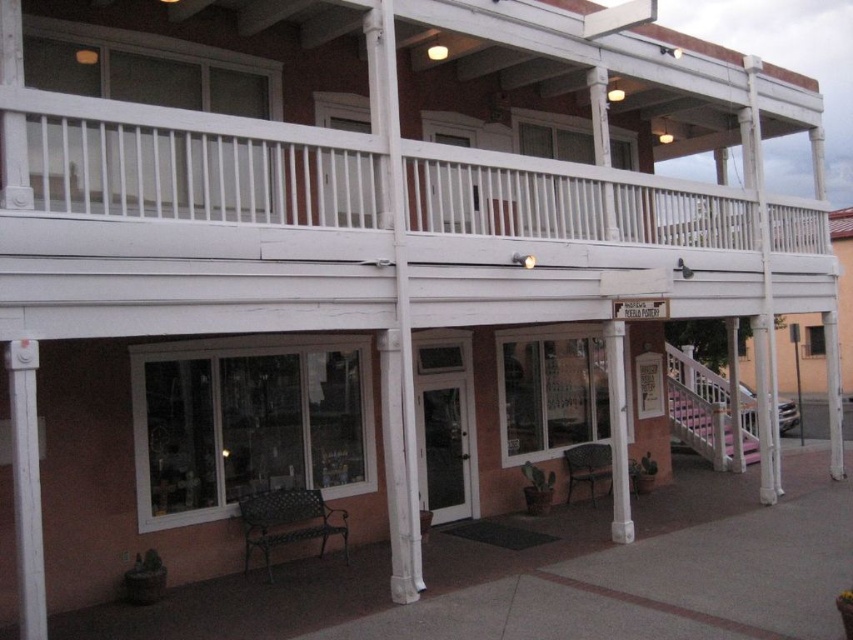
Between white painted wood column at center and white painted wood at right, which one has less height?

white painted wood at right is shorter.

Is point (627, 488) in front of point (759, 392)?

Yes, point (627, 488) is in front of point (759, 392).

Where is `white painted wood column at center`? Image resolution: width=853 pixels, height=640 pixels. white painted wood column at center is located at coordinates (618, 433).

Is white wooden railing at upper center to the right of white painted wood column at center from the viewer's perspective?

Incorrect, white wooden railing at upper center is not on the right side of white painted wood column at center.

Based on the photo, is white wooden railing at upper center wider than white painted wood column at center?

Yes.

Which is in front, point (334, 188) or point (625, 424)?

Positioned in front is point (334, 188).

Where is `white wooden railing at upper center`? This screenshot has width=853, height=640. white wooden railing at upper center is located at coordinates (364, 177).

Does point (30, 627) come farther from viewer compared to point (759, 374)?

No, it is not.

Identify the location of white painted wood at left. The image size is (853, 640). (26, 484).

The width and height of the screenshot is (853, 640). Find the location of `white painted wood at left`. white painted wood at left is located at coordinates (26, 484).